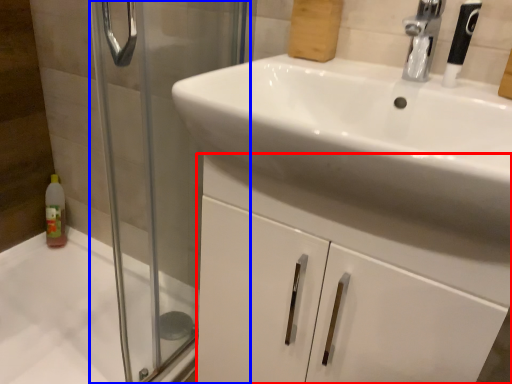
Question: Which object is further to the camera taking this photo, bathroom cabinet (highlighted by a red box) or screen door (highlighted by a blue box)?

Choices:
 (A) bathroom cabinet
 (B) screen door

Answer: (A)